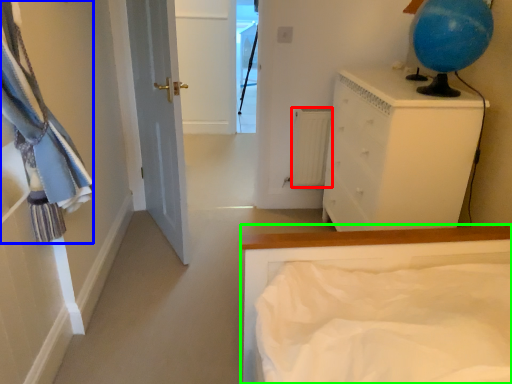
Question: Based on their relative distances, which object is nearer to radiator (highlighted by a red box)? Choose from laundry (highlighted by a blue box) and bed (highlighted by a green box).

Choices:
 (A) laundry
 (B) bed

Answer: (B)